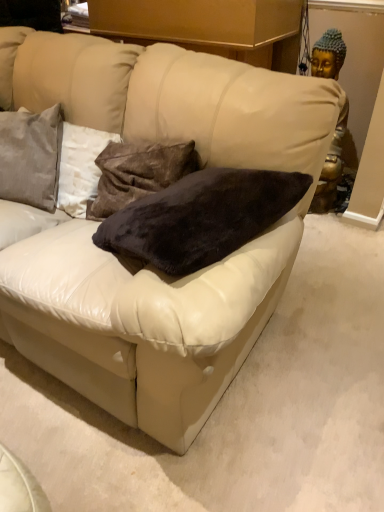
Question: Is velvety brown pillow at center, which appears as the second pillow when viewed from the left, further to camera compared to satin gray pillow at upper left, which is counted as the second pillow, starting from the right?

Choices:
 (A) yes
 (B) no

Answer: (B)

Question: Is velvety brown pillow at center, which appears as the second pillow when viewed from the left, facing towards satin gray pillow at upper left, placed as the first pillow when sorted from left to right?

Choices:
 (A) yes
 (B) no

Answer: (B)

Question: From a real-world perspective, is velvety brown pillow at center, which appears as the second pillow when viewed from the left, positioned under satin gray pillow at upper left, placed as the first pillow when sorted from left to right, based on gravity?

Choices:
 (A) yes
 (B) no

Answer: (A)

Question: Considering the relative sizes of velvety brown pillow at center, which appears as the second pillow when viewed from the left, and satin gray pillow at upper left, placed as the first pillow when sorted from left to right, in the image provided, is velvety brown pillow at center, which appears as the second pillow when viewed from the left, bigger than satin gray pillow at upper left, placed as the first pillow when sorted from left to right,?

Choices:
 (A) yes
 (B) no

Answer: (B)

Question: From the image's perspective, is velvety brown pillow at center, marked as the first pillow in a right-to-left arrangement, above satin gray pillow at upper left, placed as the first pillow when sorted from left to right?

Choices:
 (A) yes
 (B) no

Answer: (B)

Question: Is velvety brown pillow at center, which appears as the second pillow when viewed from the left, completely or partially outside of satin gray pillow at upper left, which is counted as the second pillow, starting from the right?

Choices:
 (A) yes
 (B) no

Answer: (A)

Question: Can you confirm if satin gray pillow at upper left, placed as the first pillow when sorted from left to right, is positioned to the right of velvety brown pillow at center, which appears as the second pillow when viewed from the left?

Choices:
 (A) no
 (B) yes

Answer: (A)

Question: From the image's perspective, is satin gray pillow at upper left, placed as the first pillow when sorted from left to right, above velvety brown pillow at center, which appears as the second pillow when viewed from the left?

Choices:
 (A) no
 (B) yes

Answer: (B)

Question: From a real-world perspective, is satin gray pillow at upper left, which is counted as the second pillow, starting from the right, under velvety brown pillow at center, marked as the first pillow in a right-to-left arrangement?

Choices:
 (A) no
 (B) yes

Answer: (A)

Question: Is satin gray pillow at upper left, placed as the first pillow when sorted from left to right, not near velvety brown pillow at center, which appears as the second pillow when viewed from the left?

Choices:
 (A) yes
 (B) no

Answer: (B)

Question: Is satin gray pillow at upper left, which is counted as the second pillow, starting from the right, positioned with its back to velvety brown pillow at center, marked as the first pillow in a right-to-left arrangement?

Choices:
 (A) no
 (B) yes

Answer: (A)

Question: From a real-world perspective, is satin gray pillow at upper left, placed as the first pillow when sorted from left to right, positioned over velvety brown pillow at center, marked as the first pillow in a right-to-left arrangement, based on gravity?

Choices:
 (A) yes
 (B) no

Answer: (A)

Question: Looking at their shapes, would you say velvety brown pillow at center, marked as the first pillow in a right-to-left arrangement, is wider or thinner than satin gray pillow at upper left, which is counted as the second pillow, starting from the right?

Choices:
 (A) thin
 (B) wide

Answer: (A)